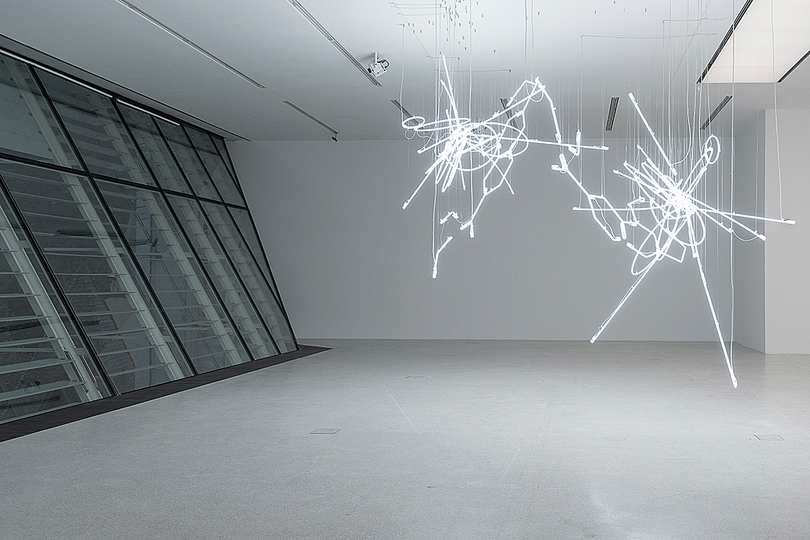
This screenshot has width=810, height=540. I want to click on white ceiling, so click(284, 38).